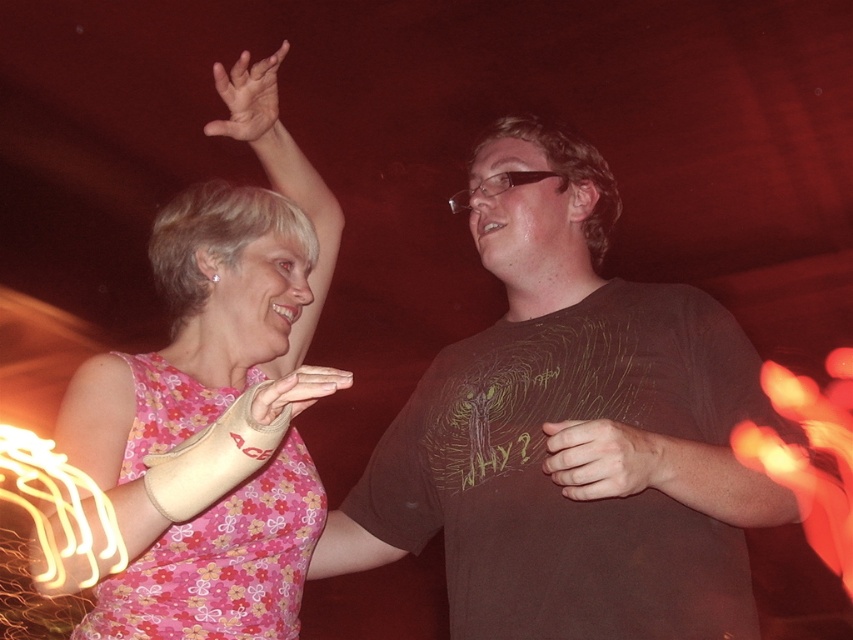
Who is positioned more to the right, brown matte t-shirt at center or smooth skin hand at center?

Positioned to the right is smooth skin hand at center.

Between point (701, 580) and point (573, 497), which one is positioned behind?

The point (701, 580) is behind.

Does point (659, 582) come closer to viewer compared to point (639, 490)?

No.

Find the location of a particular element. brown matte t-shirt at center is located at coordinates (567, 419).

Between pink floral dress at upper left and white fabric cast at upper center, which one has less height?

Standing shorter between the two is white fabric cast at upper center.

Is pink floral dress at upper left wider than white fabric cast at upper center?

Indeed, pink floral dress at upper left has a greater width compared to white fabric cast at upper center.

Is point (286, 296) positioned behind point (273, 406)?

Yes.

At what (x,y) coordinates should I click in order to perform the action: click on pink floral dress at upper left. Please return your answer as a coordinate pair (x, y). This screenshot has height=640, width=853. Looking at the image, I should click on (212, 417).

Who is lower down, brown matte t-shirt at center or pink floral dress at upper left?

Positioned lower is brown matte t-shirt at center.

Does point (693, 416) come in front of point (115, 627)?

That is False.

Where is `brown matte t-shirt at center`? Image resolution: width=853 pixels, height=640 pixels. brown matte t-shirt at center is located at coordinates (567, 419).